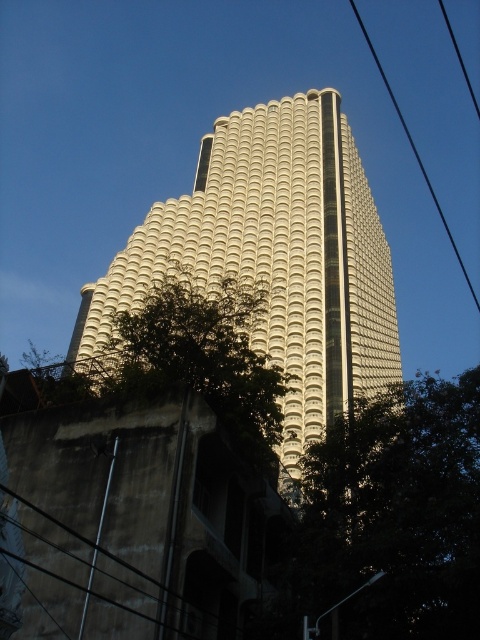
Is green leafy tree at lower right thinner than black wire at upper right?

Indeed, green leafy tree at lower right has a lesser width compared to black wire at upper right.

Is green leafy tree at lower right to the left of black wire at upper right from the viewer's perspective?

Correct, you'll find green leafy tree at lower right to the left of black wire at upper right.

The width and height of the screenshot is (480, 640). Identify the location of green leafy tree at lower right. (397, 512).

Does green leafy tree at lower right have a greater height compared to green leafy tree at center?

In fact, green leafy tree at lower right may be shorter than green leafy tree at center.

Does green leafy tree at lower right have a lesser width compared to green leafy tree at center?

Yes.

Describe the element at coordinates (397, 512) in the screenshot. I see `green leafy tree at lower right` at that location.

Image resolution: width=480 pixels, height=640 pixels. Find the location of `green leafy tree at lower right`. green leafy tree at lower right is located at coordinates (397, 512).

Does point (324, 152) lie behind point (373, 58)?

No, it is not.

You are a GUI agent. You are given a task and a screenshot of the screen. Output one action in this format:
    pyautogui.click(x=<x>, y=<y>)
    Task: Click on the white textured building at center
    This screenshot has height=640, width=480.
    Given the screenshot: What is the action you would take?
    pyautogui.click(x=275, y=257)